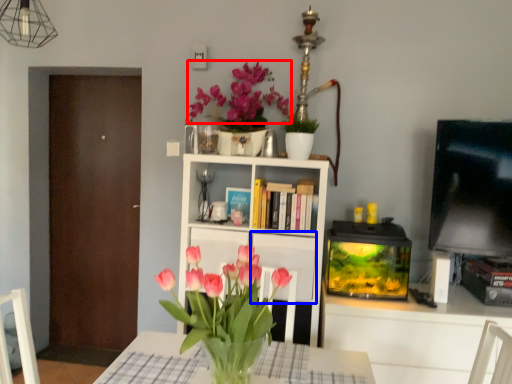
Question: Among these objects, which one is nearest to the camera, flower (highlighted by a red box) or cabinet (highlighted by a blue box)?

Choices:
 (A) flower
 (B) cabinet

Answer: (B)